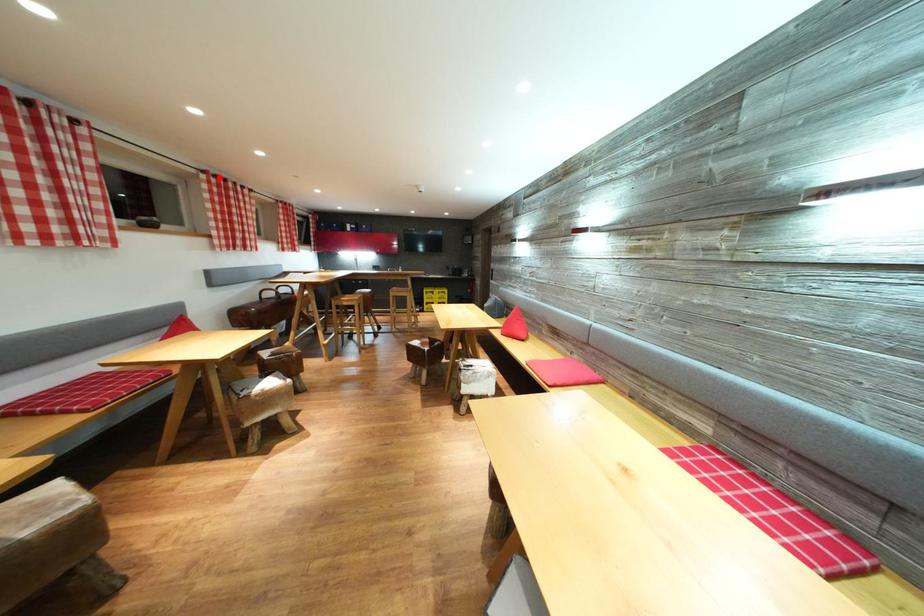
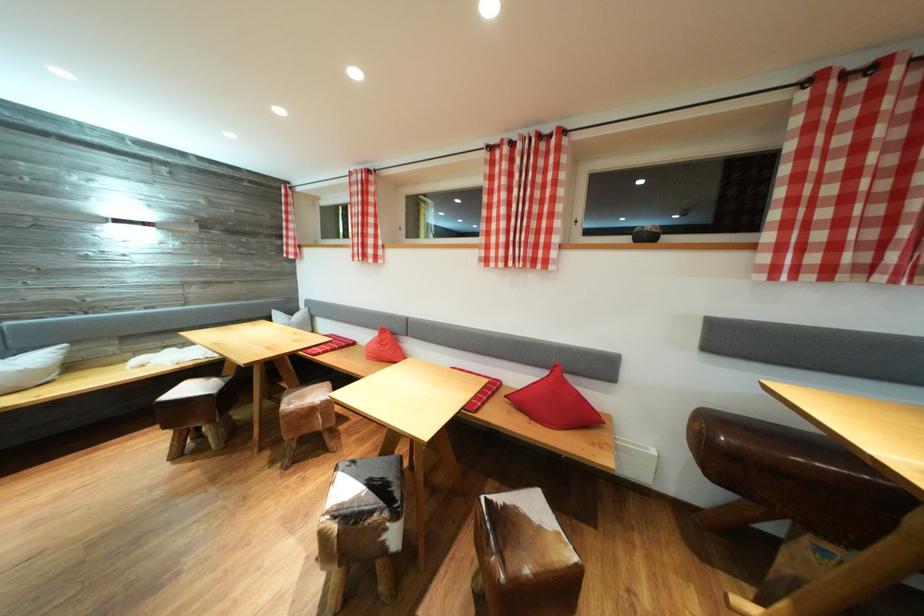
Locate, in the second image, the point that corresponds to the highlighted location in the first image.

(869, 66)